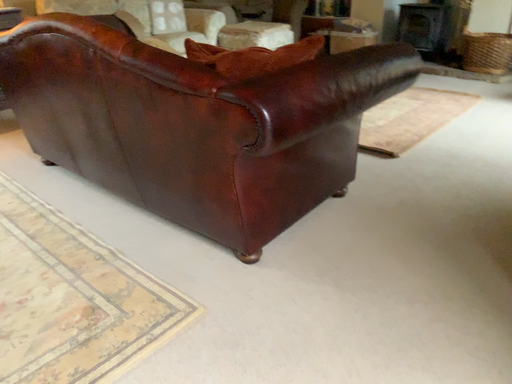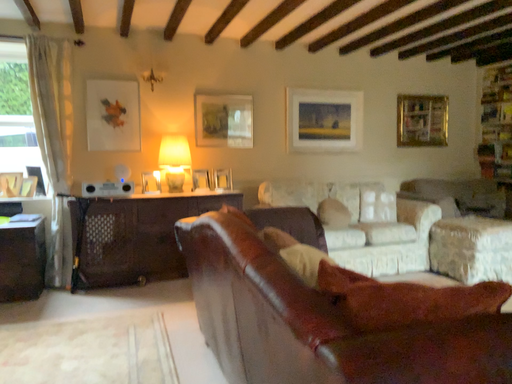
Question: Which way did the camera rotate in the video?

Choices:
 (A) rotated downward
 (B) rotated upward

Answer: (B)